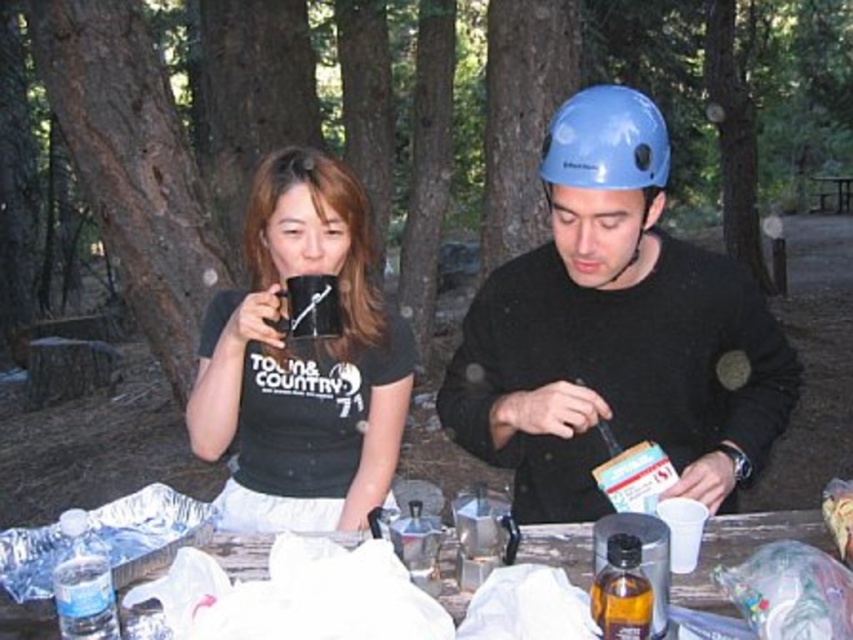
You are standing at the picnic table and want to reach the matte black mug at center. If you move your hand directly towards the mug from your current position, what coordinate point will your hand be at when it reaches the mug?

The coordinate point of the matte black mug at center is at point (302,362), so your hand will be at that coordinate when reaching it.

You are planning to place a new decorative item on the wooden picnic table at center. However, there is already a matte black mug at center. Where exactly should you place the new item to ensure it doesn

The matte black mug at center is located below the wooden picnic table at center, so placing the new item on the surface of the wooden picnic table at center would avoid overlapping with the mug.

You are planning to place a new decorative item on the wooden picnic table at center. The item is 10 cm tall. Considering the current objects on the table, will the matte black mug at center block the view of the new item from above?

The matte black mug at center is much taller than the wooden picnic table at center, so placing the new item which is only 10 cm tall might be blocked by the mug since it is taller.